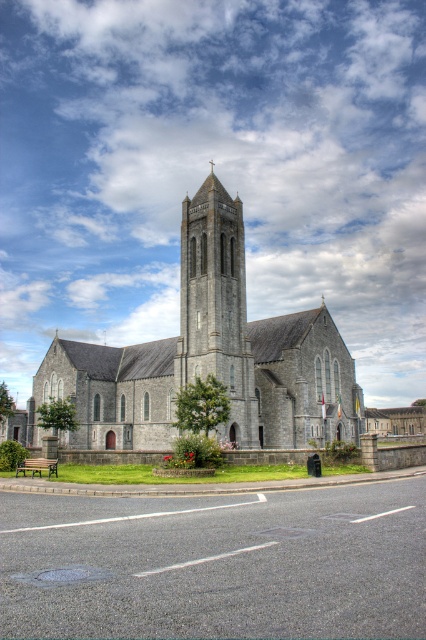
Question: Which object appears closest to the camera in this image?

Choices:
 (A) gray stone church at center
 (B) smooth stone tower at center

Answer: (A)

Question: Which point is farther to the camera?

Choices:
 (A) gray stone church at center
 (B) smooth stone tower at center

Answer: (B)

Question: Considering the relative positions of gray stone church at center and smooth stone tower at center in the image provided, where is gray stone church at center located with respect to smooth stone tower at center?

Choices:
 (A) above
 (B) below

Answer: (B)

Question: Does gray stone church at center have a lesser width compared to smooth stone tower at center?

Choices:
 (A) no
 (B) yes

Answer: (A)

Question: Can you confirm if gray stone church at center is smaller than smooth stone tower at center?

Choices:
 (A) yes
 (B) no

Answer: (B)